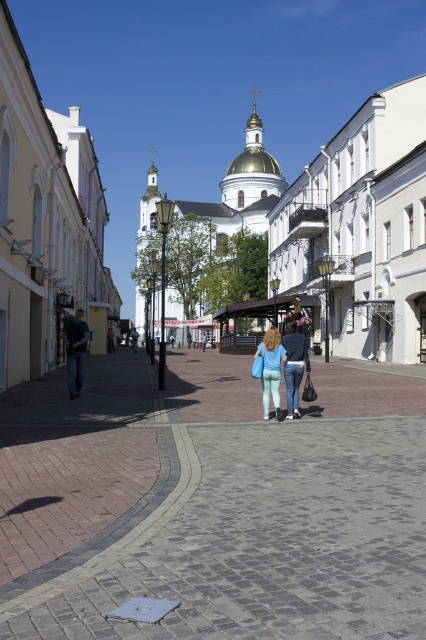
Between gray cobblestone pavement at center and denim pants at center, which one appears on the right side from the viewer's perspective?

→ denim pants at center

From the picture: Between gray cobblestone pavement at center and denim pants at center, which one is positioned lower?

Positioned lower is gray cobblestone pavement at center.

You are a GUI agent. You are given a task and a screenshot of the screen. Output one action in this format:
    pyautogui.click(x=<x>, y=<y>)
    Task: Click on the gray cobblestone pavement at center
    The image size is (426, 640).
    Given the screenshot: What is the action you would take?
    pyautogui.click(x=213, y=502)